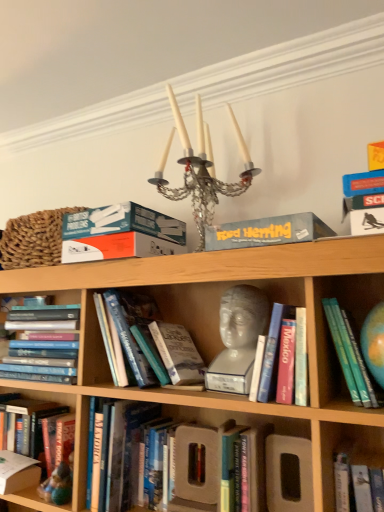
At what (x,y) coordinates should I click in order to perform the action: click on white marble bust at center. Please return your answer as a coordinate pair (x, y). This screenshot has width=384, height=512. Looking at the image, I should click on coord(238,339).

The image size is (384, 512). What are the coordinates of `braided straw basket at upper left` in the screenshot? It's located at click(33, 239).

Describe the element at coordinates (43, 343) in the screenshot. This screenshot has height=512, width=384. I see `hardcover books at center left, which ranks as the fourth book in right-to-left order` at that location.

Measure the distance between hardcover book at lower left, positioned as the 1th paperback book in bottom-to-top order, and camera.

hardcover book at lower left, positioned as the 1th paperback book in bottom-to-top order, is 1.29 meters from camera.

What is the approximate width of crystal glass candle holder at upper center?

crystal glass candle holder at upper center is 12.84 inches wide.

In order to face matte pink book at center, which appears as the fourth book when viewed from the left, should I rotate leftwards or rightwards?

Turn right approximately 12.814 degrees to face it.

You are a GUI agent. You are given a task and a screenshot of the screen. Output one action in this format:
    pyautogui.click(x=<x>, y=<y>)
    Task: Click on the white marble bust at center
    
    Given the screenshot: What is the action you would take?
    pyautogui.click(x=238, y=339)

Considering the points (27, 390) and (260, 317), which point is in front, point (27, 390) or point (260, 317)?

Point (260, 317)

Does hardcover book at lower left, which is the first book in left-to-right order, turn towards white marble bust at center?

No, hardcover book at lower left, which is the first book in left-to-right order, is not turned towards white marble bust at center.

From a real-world perspective, does hardcover book at lower left, which is the fifth book from right to left, stand above white marble bust at center?

No, from a real-world perspective, hardcover book at lower left, which is the fifth book from right to left, is not on top of white marble bust at center.

Choose the correct answer: Is hardcover book at lower left, which is the first book in left-to-right order, inside white marble bust at center or outside it?

hardcover book at lower left, which is the first book in left-to-right order, is outside white marble bust at center.

In the image, is teal matte board game box at upper center, the third paperback book ordered from the bottom, positioned in front of or behind braided straw basket at upper left?

teal matte board game box at upper center, the third paperback book ordered from the bottom, is positioned closer to the viewer than braided straw basket at upper left.

Considering the sizes of objects teal matte board game box at upper center, arranged as the 1th paperback book when viewed from the top, and braided straw basket at upper left in the image provided, who is shorter, teal matte board game box at upper center, arranged as the 1th paperback book when viewed from the top, or braided straw basket at upper left?

With less height is teal matte board game box at upper center, arranged as the 1th paperback book when viewed from the top.

Could you measure the distance between teal matte board game box at upper center, the 2th paperback book from the left, and braided straw basket at upper left?

A distance of 7.35 inches exists between teal matte board game box at upper center, the 2th paperback book from the left, and braided straw basket at upper left.

Is matte pink book at center, which appears as the second book when viewed from the right, taller than crystal glass candle holder at upper center?

No, matte pink book at center, which appears as the second book when viewed from the right, is not taller than crystal glass candle holder at upper center.

How far apart are matte pink book at center, which appears as the fourth book when viewed from the left, and crystal glass candle holder at upper center?

matte pink book at center, which appears as the fourth book when viewed from the left, and crystal glass candle holder at upper center are 21.85 inches apart from each other.

From a real-world perspective, is matte pink book at center, which appears as the second book when viewed from the right, over crystal glass candle holder at upper center?

No, from a real-world perspective, matte pink book at center, which appears as the second book when viewed from the right, is not on top of crystal glass candle holder at upper center.

From the image's perspective, is matte pink book at center, which appears as the second book when viewed from the right, below crystal glass candle holder at upper center?

Yes, from the image's perspective, matte pink book at center, which appears as the second book when viewed from the right, is below crystal glass candle holder at upper center.

From the image's perspective, which is below, hardcover book at lower left, which is the first book in left-to-right order, or hardcover book at lower left, positioned as the 1th paperback book in bottom-to-top order?

From the image's view, hardcover book at lower left, positioned as the 1th paperback book in bottom-to-top order, is below.

Who is more distant, hardcover book at lower left, which is the fifth book from right to left, or hardcover book at lower left, positioned as the 3th paperback book in right-to-left order?

hardcover book at lower left, which is the fifth book from right to left.

Is hardcover book at lower left, which is the fifth book from right to left, positioned far away from hardcover book at lower left, positioned as the 3th paperback book in right-to-left order?

That's not correct — hardcover book at lower left, which is the fifth book from right to left, is a little close to hardcover book at lower left, positioned as the 3th paperback book in right-to-left order.

Considering the relative sizes of hardcover book at lower left, which is the first book in left-to-right order, and hardcover book at lower left, positioned as the 1th paperback book in bottom-to-top order, in the image provided, is hardcover book at lower left, which is the first book in left-to-right order, shorter than hardcover book at lower left, positioned as the 1th paperback book in bottom-to-top order,?

No, hardcover book at lower left, which is the first book in left-to-right order, is not shorter than hardcover book at lower left, positioned as the 1th paperback book in bottom-to-top order.

Between teal hardcover book at right, arranged as the 1th book when viewed from the right, and braided straw basket at upper left, which one has larger size?

braided straw basket at upper left is bigger.

From a real-world perspective, who is located lower, teal hardcover book at right, arranged as the 1th book when viewed from the right, or braided straw basket at upper left?

From a 3D spatial view, teal hardcover book at right, arranged as the 1th book when viewed from the right, is below.

Which object is wider, teal hardcover book at right, arranged as the 1th book when viewed from the right, or braided straw basket at upper left?

Wider between the two is teal hardcover book at right, arranged as the 1th book when viewed from the right.

Looking at this image, is teal matte board game box at upper center, the 2th paperback book from the left, positioned before crystal glass candle holder at upper center?

That is False.

Is teal matte board game box at upper center, the 2th paperback book from the left, thinner than crystal glass candle holder at upper center?

Yes.

Is teal matte board game box at upper center, arranged as the 1th paperback book when viewed from the top, looking in the opposite direction of crystal glass candle holder at upper center?

No, crystal glass candle holder at upper center is not at the back of teal matte board game box at upper center, arranged as the 1th paperback book when viewed from the top.

Is teal matte board game box at upper center, marked as the 2th paperback book in a right-to-left arrangement, not near crystal glass candle holder at upper center?

teal matte board game box at upper center, marked as the 2th paperback book in a right-to-left arrangement, is near crystal glass candle holder at upper center, not far away.

Does matte pink book at center, which appears as the second book when viewed from the right, have a smaller size compared to teal matte board game box at upper center, marked as the 2th paperback book in a right-to-left arrangement?

Yes, matte pink book at center, which appears as the second book when viewed from the right, is smaller than teal matte board game box at upper center, marked as the 2th paperback book in a right-to-left arrangement.

Looking at this image, which point is more distant from viewer, (285, 374) or (116, 249)?

Positioned behind is point (116, 249).

Are matte pink book at center, which appears as the fourth book when viewed from the left, and teal matte board game box at upper center, the 2th paperback book from the left, making contact?

No, matte pink book at center, which appears as the fourth book when viewed from the left, is not beside teal matte board game box at upper center, the 2th paperback book from the left.

From the image's perspective, is matte pink book at center, which appears as the second book when viewed from the right, above teal matte board game box at upper center, the 2th paperback book from the left?

Actually, matte pink book at center, which appears as the second book when viewed from the right, appears below teal matte board game box at upper center, the 2th paperback book from the left, in the image.

Starting from the white marble bust at center, which book is the 3rd one behind? Please provide its 2D coordinates.

[(31, 425)]

Locate an element on the screen. Image resolution: width=384 pixels, height=512 pixels. basket above the teal matte board game box at upper center, the third paperback book ordered from the bottom (from a real-world perspective) is located at coordinates (33, 239).

When comparing their distances from teal matte board game box at upper center, marked as the 2th paperback book in a right-to-left arrangement, does hardcover book at lower left, positioned as the third paperback book in top-to-bottom order, or braided straw basket at upper left seem further?

Based on the image, hardcover book at lower left, positioned as the third paperback book in top-to-bottom order, appears to be further to teal matte board game box at upper center, marked as the 2th paperback book in a right-to-left arrangement.

Which object lies nearer to the anchor point hardcover book at center, acting as the third book starting from the left, hardcover book at lower left, which is the first book in left-to-right order, or braided straw basket at upper left?

braided straw basket at upper left lies closer to hardcover book at center, acting as the third book starting from the left, than the other object.

Based on their spatial positions, is hardcover book at center, acting as the third book starting from the left, or braided straw basket at upper left further from hardcover book at lower left, which is the first book in left-to-right order?

braided straw basket at upper left is further to hardcover book at lower left, which is the first book in left-to-right order.

Considering their positions, is blue cardboard box at upper center, the 2th paperback book positioned from the bottom, positioned closer to braided straw basket at upper left than teal hardcover book at right, the 5th book in the left-to-right sequence?

blue cardboard box at upper center, the 2th paperback book positioned from the bottom.

When comparing their distances from braided straw basket at upper left, does matte pink book at center, which appears as the second book when viewed from the right, or hardcover book at lower left, acting as the first paperback book starting from the left, seem closer?

Among the two, hardcover book at lower left, acting as the first paperback book starting from the left, is located nearer to braided straw basket at upper left.

Based on their spatial positions, is hardcover book at center, acting as the third book starting from the left, or hardcover book at lower left, positioned as the third paperback book in top-to-bottom order, closer to hardcover book at lower left, which is the fifth book from right to left?

Based on the image, hardcover book at lower left, positioned as the third paperback book in top-to-bottom order, appears to be nearer to hardcover book at lower left, which is the fifth book from right to left.

From the image, which object appears to be nearer to matte pink book at center, which appears as the fourth book when viewed from the left, teal hardcover book at right, arranged as the 1th book when viewed from the right, or blue cardboard box at upper center, the 2th paperback book positioned from the bottom?

Among the two, teal hardcover book at right, arranged as the 1th book when viewed from the right, is located nearer to matte pink book at center, which appears as the fourth book when viewed from the left.

When comparing their distances from crystal glass candle holder at upper center, does blue cardboard box at upper center, the 2th paperback book positioned from the bottom, or white marble bust at center seem closer?

The object closer to crystal glass candle holder at upper center is blue cardboard box at upper center, the 2th paperback book positioned from the bottom.

You are a GUI agent. You are given a task and a screenshot of the screen. Output one action in this format:
    pyautogui.click(x=<x>, y=<y>)
    Task: Click on the book located between white marble bust at center and teal hardcover book at right, the 5th book in the left-to-right sequence, in the left-right direction
    This screenshot has height=512, width=384.
    Given the screenshot: What is the action you would take?
    pyautogui.click(x=285, y=357)

Identify the location of book that lies between crystal glass candle holder at upper center and white marble bust at center from top to bottom. (351, 357).

Identify the location of candle holder between braided straw basket at upper left and white marble bust at center from left to right. (201, 169).

The image size is (384, 512). In order to click on person between hardcover books at center left, which is the 2th book in left-to-right order, and matte pink book at center, which appears as the second book when viewed from the right, from left to right in this screenshot , I will do `click(238, 339)`.